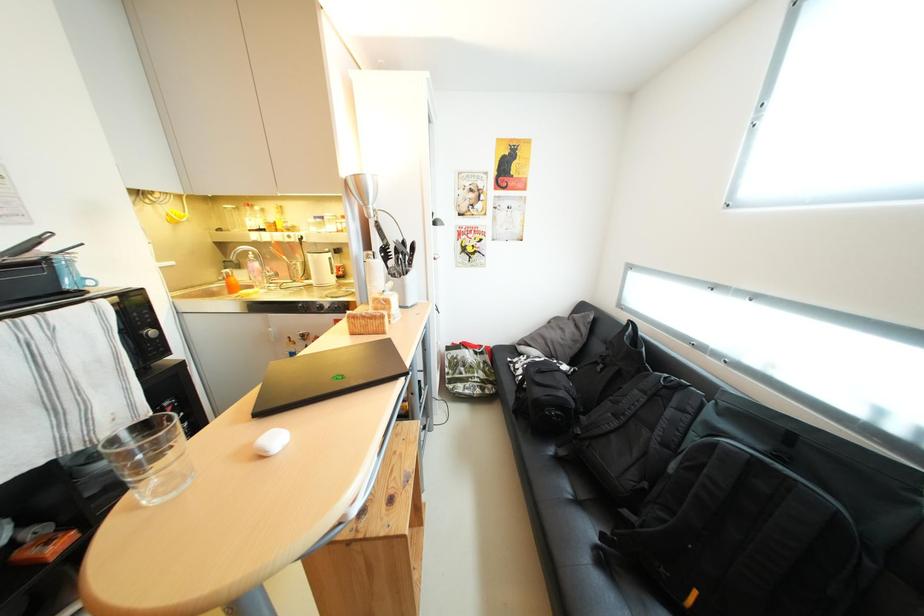
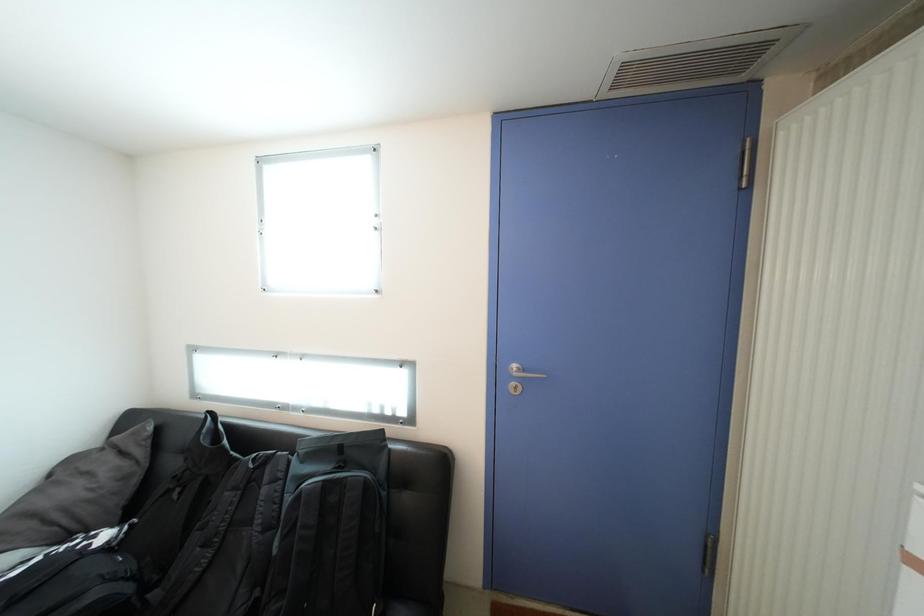
Question: The camera is either moving clockwise (left) or counter-clockwise (right) around the object. The first image is from the beginning of the video and the second image is from the end. Is the camera moving left or right when shooting the video?

Choices:
 (A) Left
 (B) Right

Answer: (A)